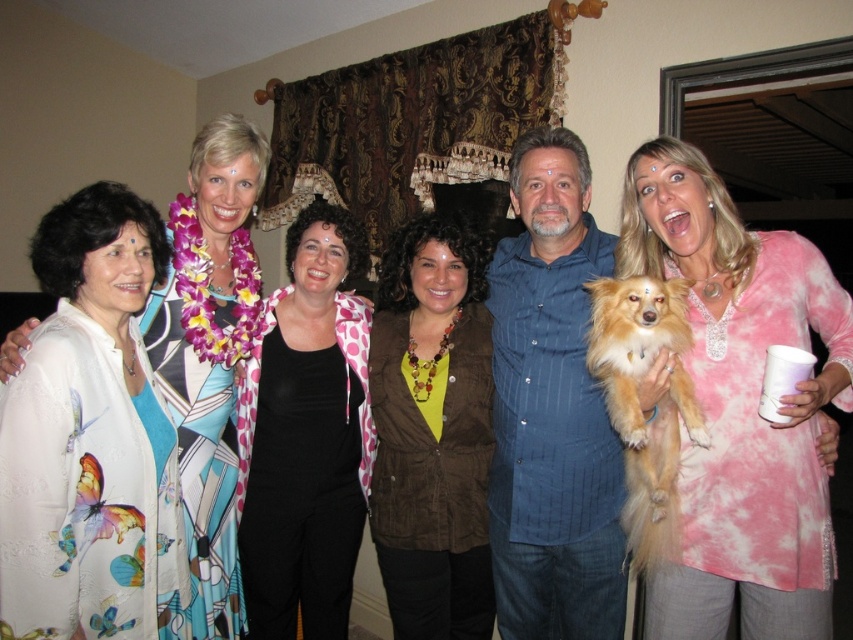
You are a photographer setting up for a group photo. You need to ensure that the printed silk blouse at left and the golden fur dog at right are positioned so they are at least 40 inches apart for better composition. Based on the current setup, can you confirm if they meet this requirement?

The printed silk blouse at left and golden fur dog at right are currently 38.32 inches apart, which is less than the required 40 inches. To meet the requirement, they need to be moved further apart by approximately 1.68 inches.

You are organizing a photoshoot and need to arrange the black polka dot jacket at center and the printed silk blouse at left on a mannequin. Since space is limited, you want to know which item requires more horizontal space. Which one should you allocate more space to?

The black polka dot jacket at center requires more horizontal space because its width is larger than the printed silk blouse at left.